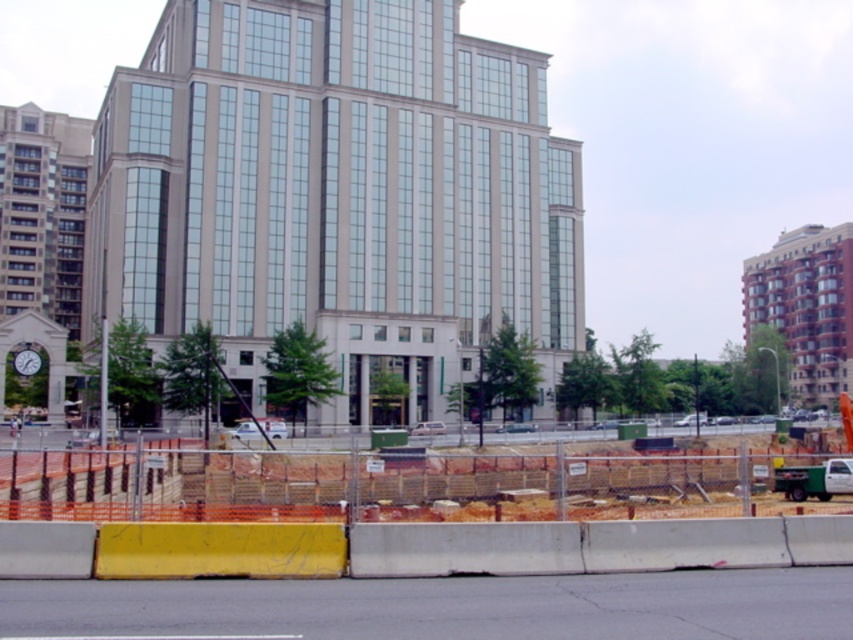
You are a city planner reviewing this urban layout. You need to determine if the beige glass building at center can be seen from the orange plastic barrier at lower center. Based on their sizes and positions, what is your conclusion?

The beige glass building at center is bigger than the orange plastic barrier at lower center, so it is likely that the beige glass building at center can be seen from the orange plastic barrier at lower center as it is larger and presumably taller.

You are a delivery driver approaching the beige glass building at center and the white hard hat at center in the image. Which object should you avoid hitting first while driving straight ahead?

You should avoid hitting the white hard hat at center first because it is positioned to the left of the beige glass building at center, making it closer to your path as you drive straight ahead.